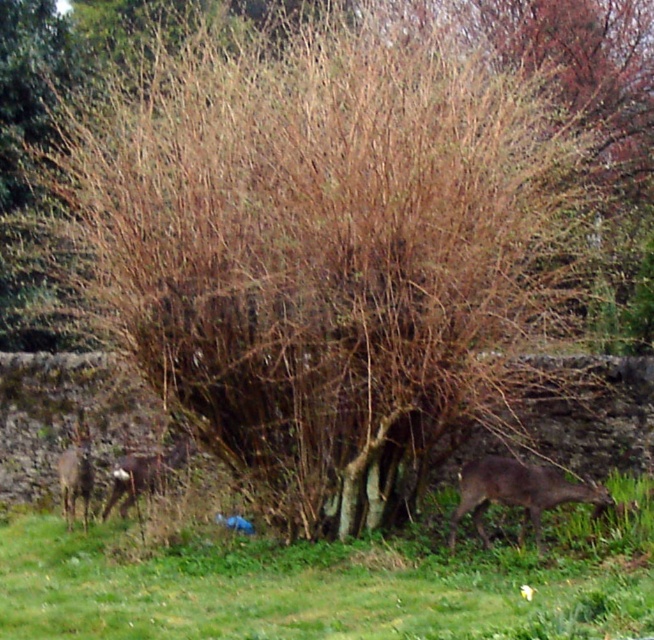
You are standing in the natural outdoor scene described. You notice the green grass at lower center and the brown furry deer at center. Which object is shorter?

The green grass at lower center is shorter than the brown furry deer at center.

You are a photographer trying to capture the brown furry deer at lower right in the frame. The green grass at lower center is blocking your view. Can you adjust your position so that the deer is fully visible without the grass covering it?

The green grass at lower center is bigger than the brown furry deer at lower right. Since the grass is larger, moving your position to the left or right might allow you to position the deer so that it is no longer obscured by the grass. Alternatively, moving closer could help frame the deer around the grass.